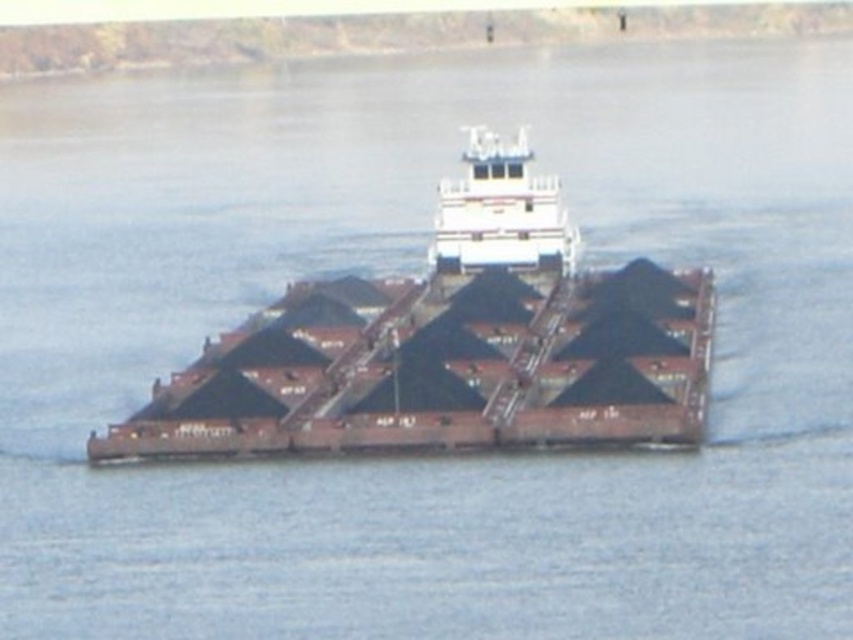
Question: Can you confirm if brown matte cargo ship at center is positioned to the left of white matte barge at center?

Choices:
 (A) yes
 (B) no

Answer: (A)

Question: Among these points, which one is nearest to the camera?

Choices:
 (A) (555, 246)
 (B) (276, 332)

Answer: (B)

Question: Is brown matte cargo ship at center smaller than white matte barge at center?

Choices:
 (A) no
 (B) yes

Answer: (B)

Question: Among these objects, which one is farthest from the camera?

Choices:
 (A) white matte barge at center
 (B) brown matte cargo ship at center

Answer: (A)

Question: Is brown matte cargo ship at center below white matte barge at center?

Choices:
 (A) no
 (B) yes

Answer: (B)